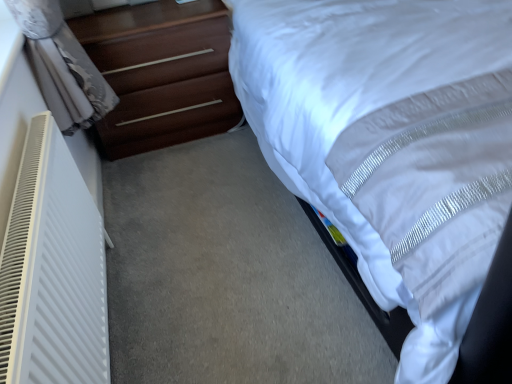
Question: Considering the positions of white satin bed at upper right and dark brown wood chest of drawers at left in the image, is white satin bed at upper right taller or shorter than dark brown wood chest of drawers at left?

Choices:
 (A) tall
 (B) short

Answer: (A)

Question: Considering the positions of white satin bed at upper right and dark brown wood chest of drawers at left in the image, is white satin bed at upper right bigger or smaller than dark brown wood chest of drawers at left?

Choices:
 (A) big
 (B) small

Answer: (A)

Question: Which of these objects is positioned farthest from the white satin bed at upper right?

Choices:
 (A) white plastic radiator at left
 (B) dark brown wood chest of drawers at left

Answer: (A)

Question: Based on their relative distances, which object is farther from the white satin bed at upper right?

Choices:
 (A) dark brown wood chest of drawers at left
 (B) white plastic radiator at left

Answer: (B)